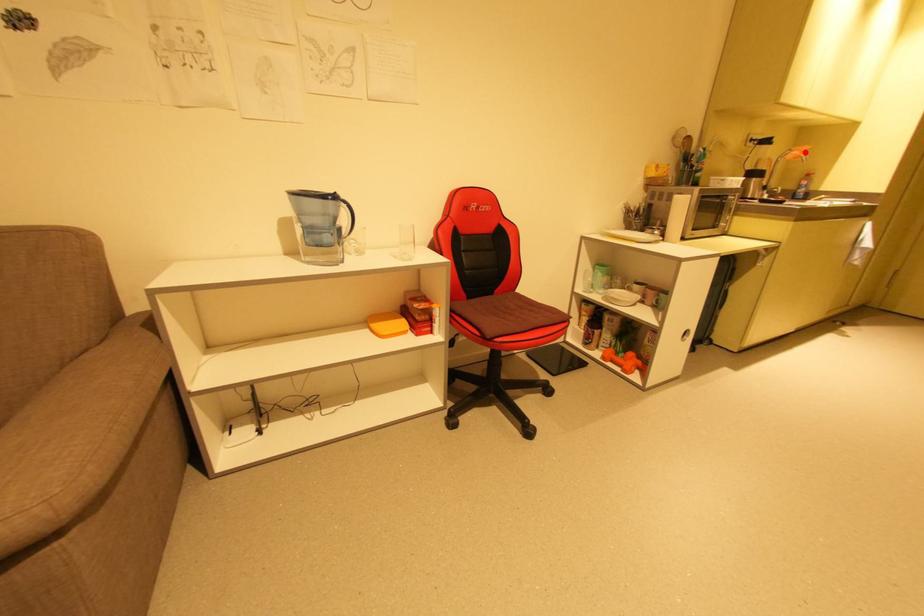
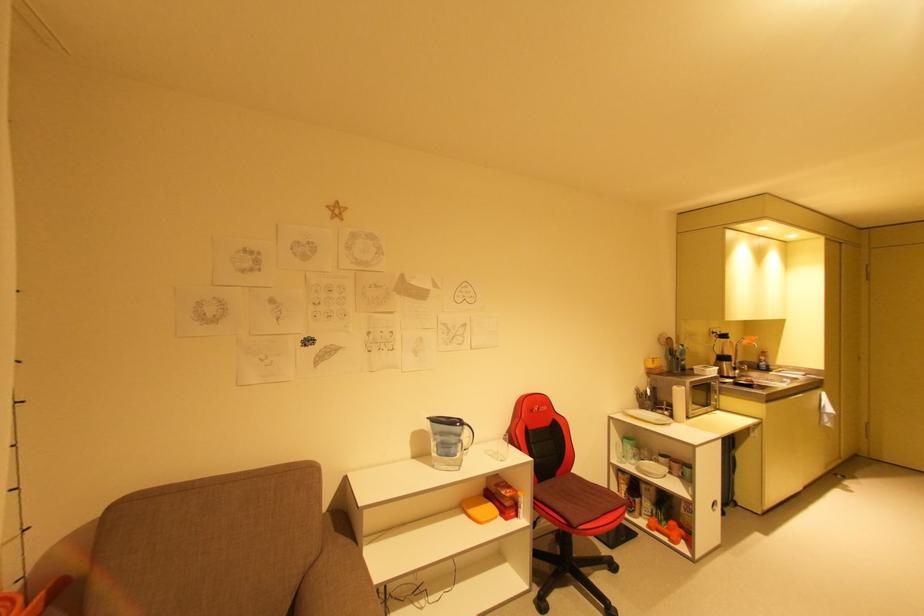
Question: I am providing you with two images of the same scene from different viewpoints. Image1 has a red point marked. In image2, the corresponding 3D location appears at what relative position? Reply with the corresponding letter.

Choices:
 (A) Closer
 (B) Farther

Answer: (A)